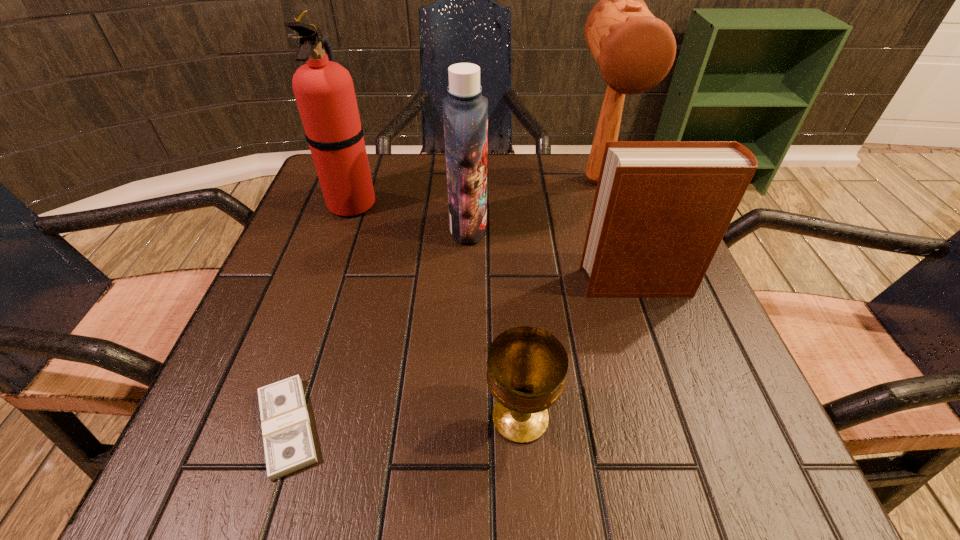
Locate an element on the screen. vacant point at the right edge is located at coordinates (702, 326).

Locate an element on the screen. free region at the far left corner of the desktop is located at coordinates (373, 159).

The height and width of the screenshot is (540, 960). In the image, there is a desktop. What are the coordinates of `free space at the near left corner` in the screenshot? It's located at (166, 489).

In the image, there is a desktop. Identify the location of vacant space at the far right corner. This screenshot has height=540, width=960. (578, 193).

You are a GUI agent. You are given a task and a screenshot of the screen. Output one action in this format:
    pyautogui.click(x=<x>, y=<y>)
    Task: Click on the free area in between the shortest object and the chalice
    This screenshot has height=540, width=960.
    Given the screenshot: What is the action you would take?
    pyautogui.click(x=404, y=422)

This screenshot has width=960, height=540. Find the location of `free space between the dollar and the mallet`. free space between the dollar and the mallet is located at coordinates (443, 303).

In order to click on vacant area that lies between the shortest object and the fire extinguisher in this screenshot , I will do `click(320, 315)`.

The image size is (960, 540). Find the location of `unoccupied area between the mallet and the third tallest object`. unoccupied area between the mallet and the third tallest object is located at coordinates (533, 204).

Locate an element on the screen. This screenshot has height=540, width=960. vacant area that lies between the shortest object and the second shortest object is located at coordinates (404, 422).

Where is `free space between the fourth shortest object and the third shortest object`? The width and height of the screenshot is (960, 540). free space between the fourth shortest object and the third shortest object is located at coordinates (553, 255).